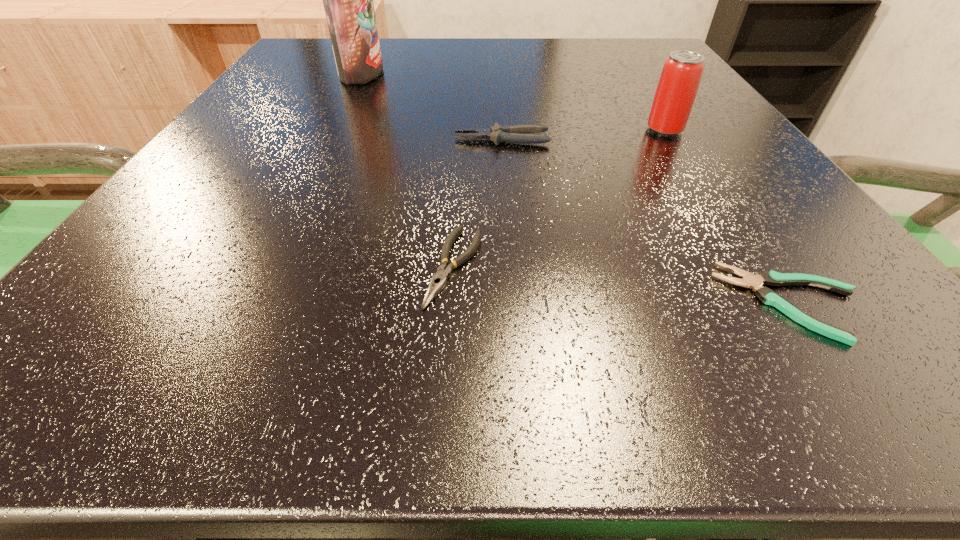
Locate an element on the screen. The height and width of the screenshot is (540, 960). vacant space positioned 0.330m at the gripping part of the farthest pliers is located at coordinates (244, 139).

This screenshot has height=540, width=960. In order to click on vacant space located at the gripping part of the farthest pliers in this screenshot , I will do `click(230, 139)`.

Locate an element on the screen. This screenshot has width=960, height=540. free spot located 0.310m at the gripping part of the farthest pliers is located at coordinates (256, 139).

The image size is (960, 540). Identify the location of blank space located 0.270m on the back of the second shortest object. (463, 126).

Locate an element on the screen. This screenshot has height=540, width=960. vacant space located on the left of the rightmost pliers is located at coordinates (536, 302).

Locate an element on the screen. The image size is (960, 540). object that is at the far edge is located at coordinates (348, 0).

Find the location of a particular element. The image size is (960, 540). object located in the left edge section of the desktop is located at coordinates (348, 0).

At what (x,y) coordinates should I click in order to perform the action: click on beer can at the right edge. Please return your answer as a coordinate pair (x, y). The height and width of the screenshot is (540, 960). Looking at the image, I should click on (682, 71).

Locate an element on the screen. This screenshot has height=540, width=960. pliers present at the right edge is located at coordinates (769, 297).

Where is `object at the far left corner`? object at the far left corner is located at coordinates (348, 0).